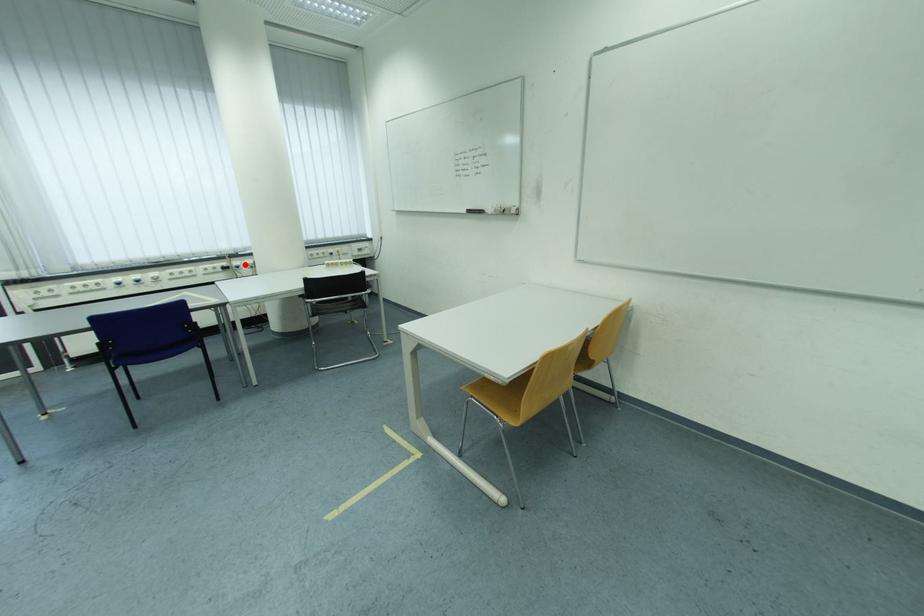
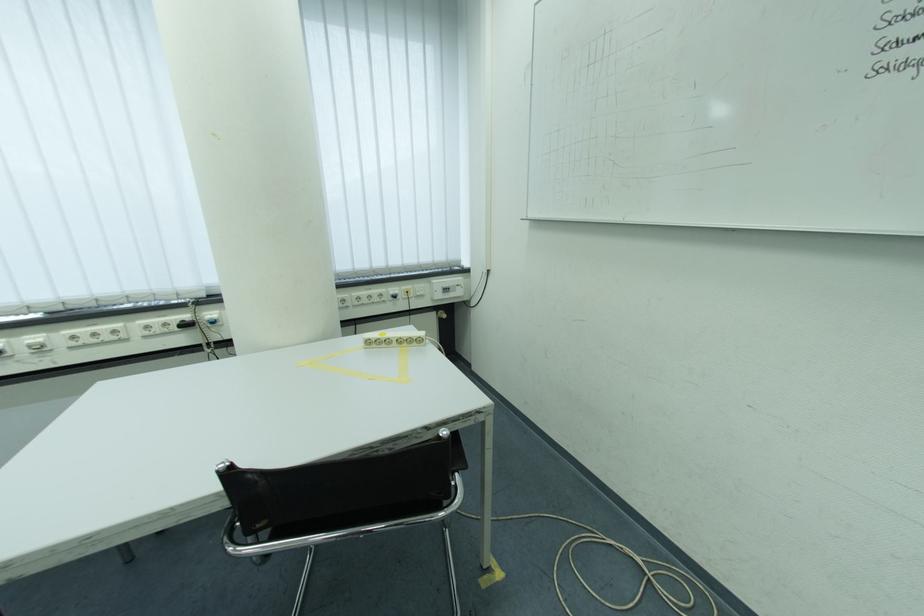
The point at the highlighted location is marked in the first image. Where is the corresponding point in the second image?

(217, 315)